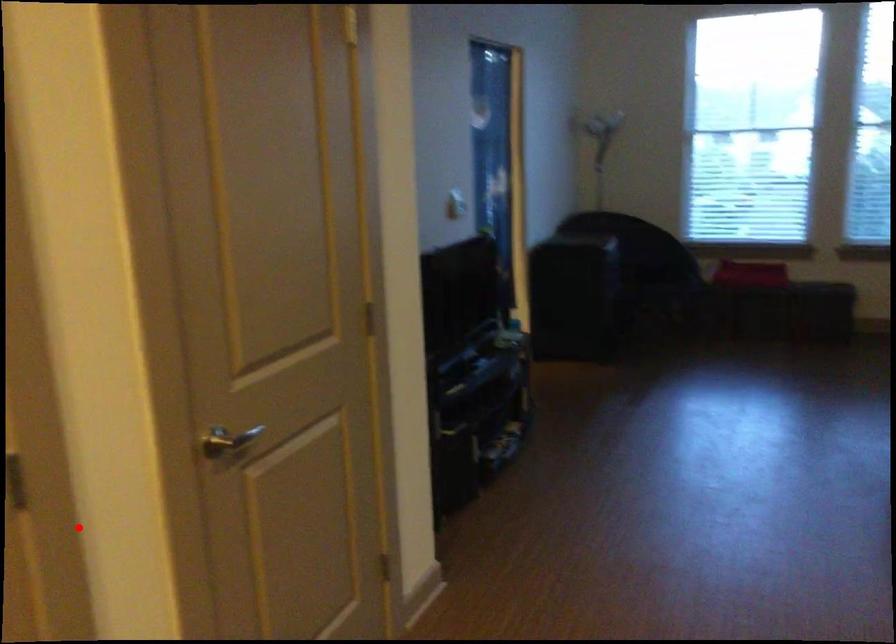
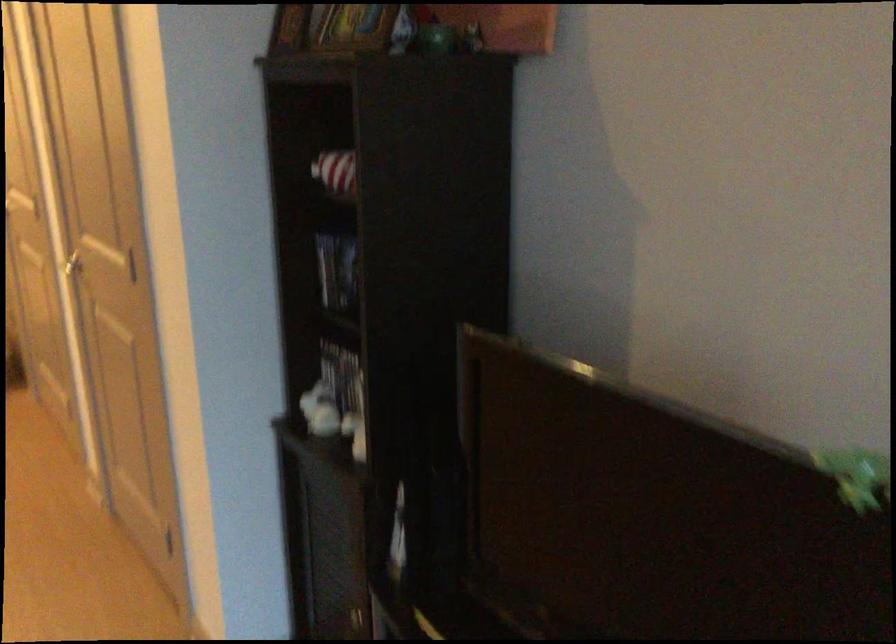
Question: I am providing you with two images of the same scene from different viewpoints. Image1 has a red point marked. In image2, the corresponding 3D location appears at what relative position? Reply with the corresponding letter.

Choices:
 (A) Closer
 (B) Farther

Answer: (B)